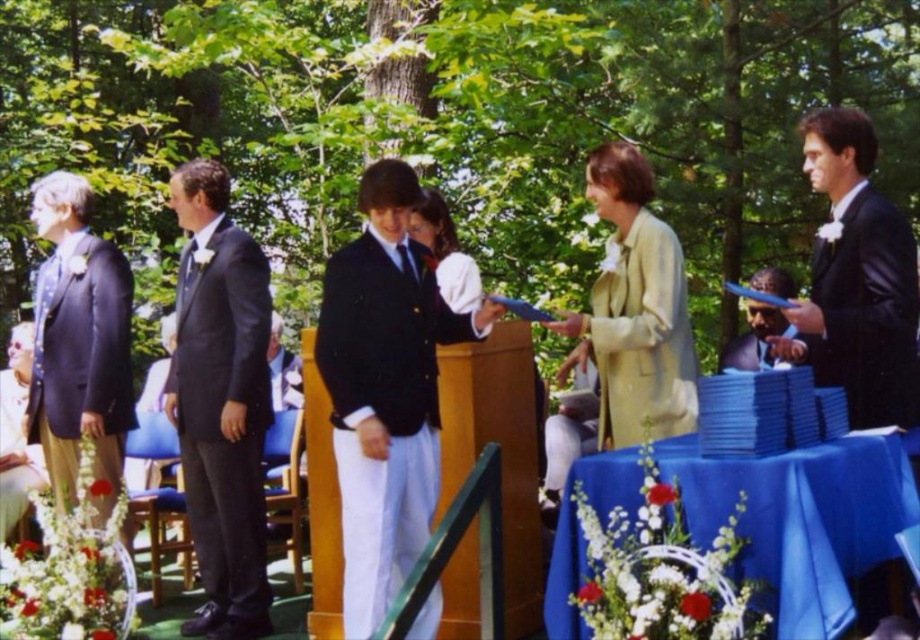
Who is shorter, black satin suit at left or black leather suit at right?

With less height is black leather suit at right.

Consider the image. Can you confirm if black satin suit at left is bigger than black leather suit at right?

Correct, black satin suit at left is larger in size than black leather suit at right.

The image size is (920, 640). Describe the element at coordinates (221, 403) in the screenshot. I see `black satin suit at left` at that location.

The width and height of the screenshot is (920, 640). Find the location of `black satin suit at left`. black satin suit at left is located at coordinates (221, 403).

Between black leather suit at right and matte black suit at center, which one appears on the left side from the viewer's perspective?

From the viewer's perspective, matte black suit at center appears more on the left side.

Which is below, black leather suit at right or matte black suit at center?

matte black suit at center is below.

Identify the location of black leather suit at right. This screenshot has height=640, width=920. (859, 276).

Does point (56, 236) come behind point (683, 330)?

Yes, it is behind point (683, 330).

The height and width of the screenshot is (640, 920). Describe the element at coordinates (78, 342) in the screenshot. I see `matte black suit at left` at that location.

Image resolution: width=920 pixels, height=640 pixels. I want to click on matte black suit at left, so click(78, 342).